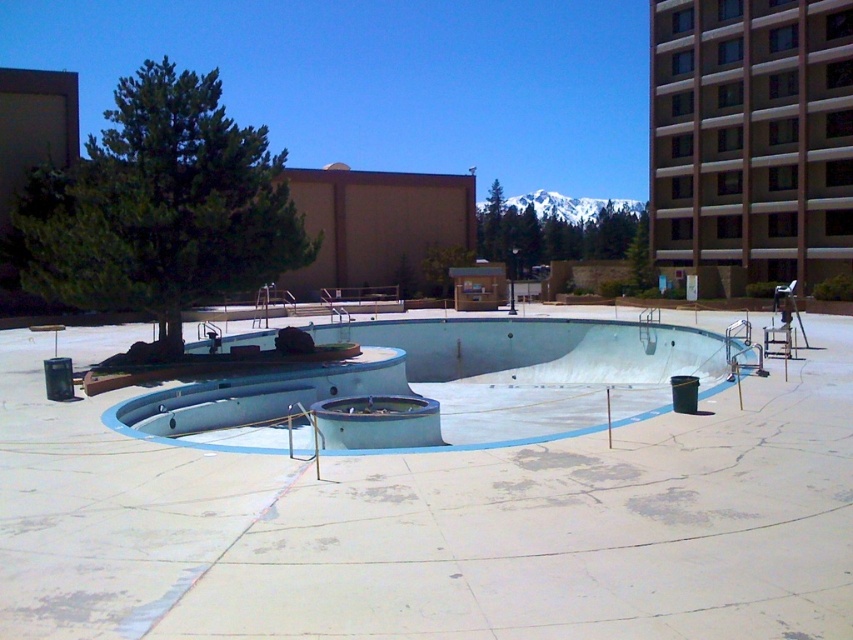
Does point (169, 472) come in front of point (204, 433)?

Yes, it is in front of point (204, 433).

What do you see at coordinates (439, 493) in the screenshot?
I see `smooth concrete skate park at center` at bounding box center [439, 493].

Where is `smooth concrete skate park at center`? The image size is (853, 640). smooth concrete skate park at center is located at coordinates point(439,493).